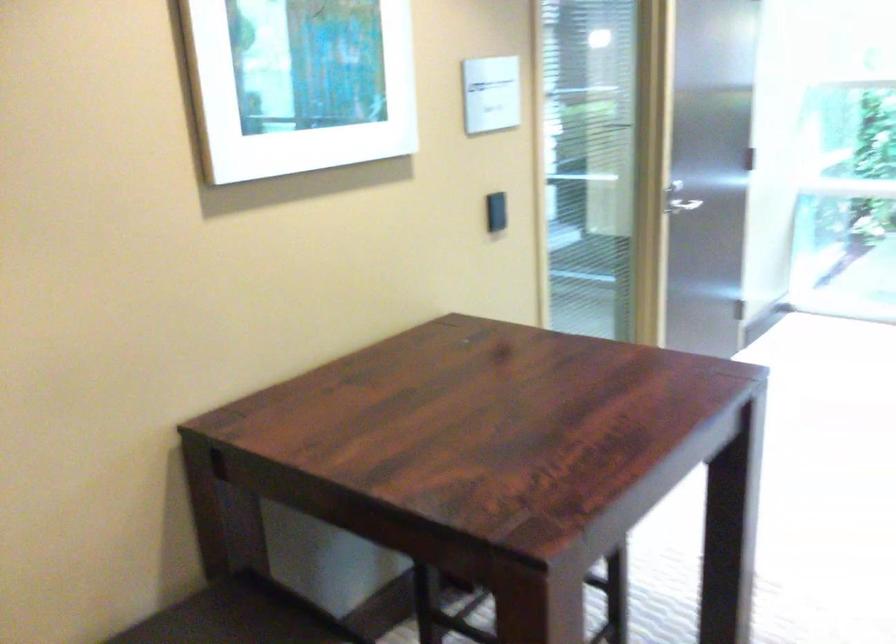
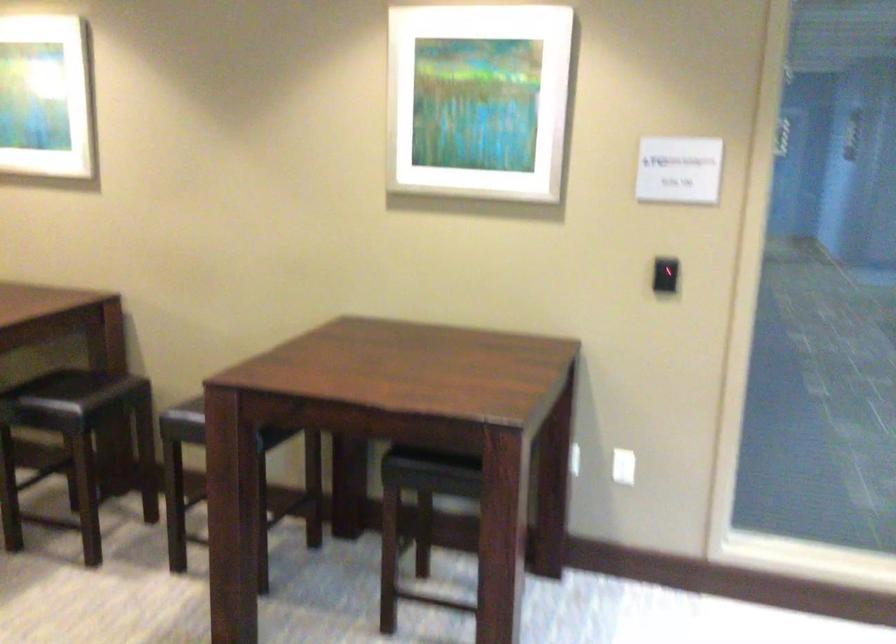
The point at (513, 207) is marked in the first image. Where is the corresponding point in the second image?

(665, 275)